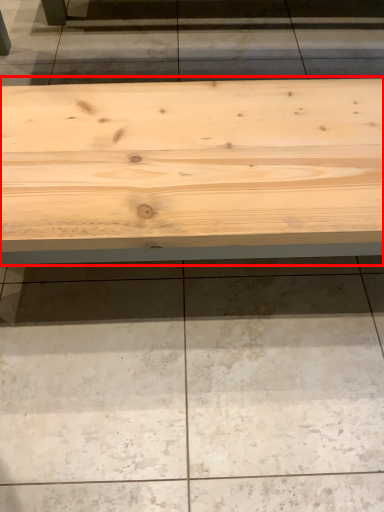
Question: From the image's perspective, what is the correct spatial relationship of table (annotated by the red box) in relation to concrete?

Choices:
 (A) below
 (B) above

Answer: (B)